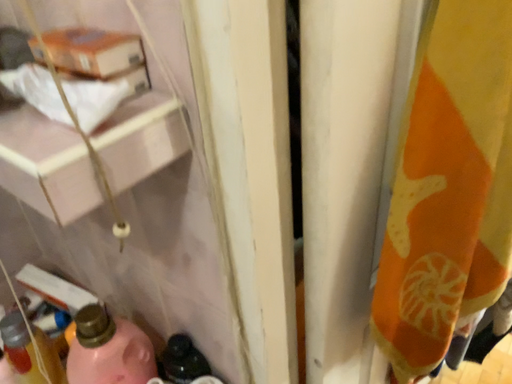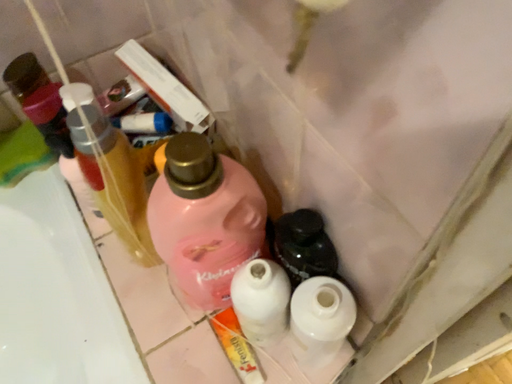
Question: How did the camera likely rotate when shooting the video?

Choices:
 (A) rotated left
 (B) rotated right

Answer: (A)